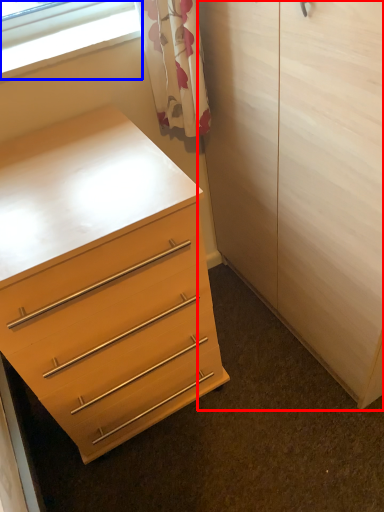
Question: Which point is closer to the camera, armoire (highlighted by a red box) or window (highlighted by a blue box)?

Choices:
 (A) armoire
 (B) window

Answer: (A)